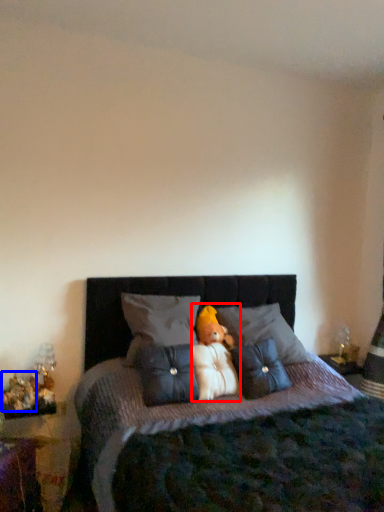
Question: Among these objects, which one is nearest to the camera, doll (highlighted by a red box) or toy (highlighted by a blue box)?

Choices:
 (A) doll
 (B) toy

Answer: (B)